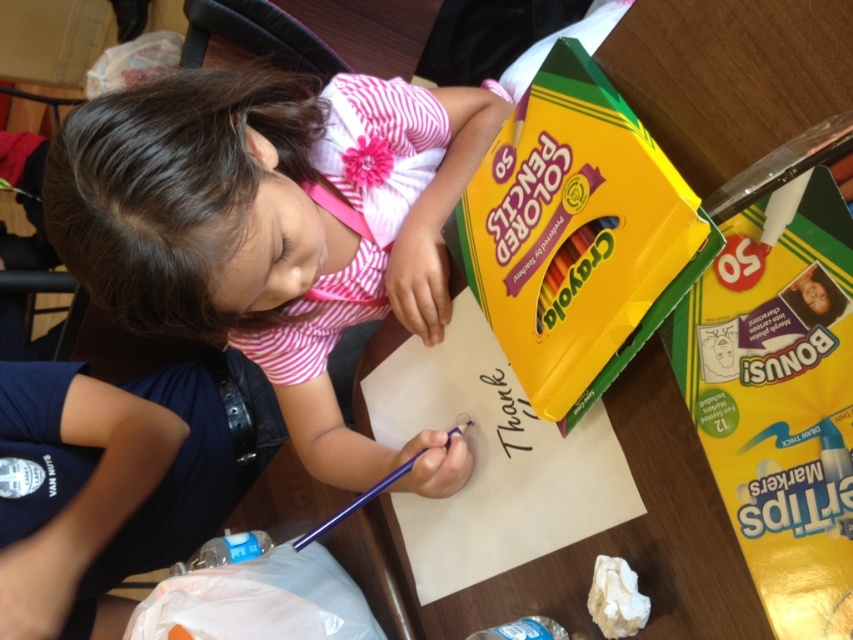
Looking at this image, you are an art teacher organizing supplies. You need to place the yellow glossy markers at right and the matte yellow crayola colored pencils at upper right into a storage bin. Which object should you place first to ensure both fit properly?

The matte yellow crayola colored pencils at upper right should be placed first because the yellow glossy markers at right is positioned under it, meaning the markers are lower and might be beneath the pencils, requiring the pencils to be placed first to make space.

Based on the photo, you are a child trying to reach the yellow glossy markers at right to draw with them. The smooth pink shirt at center is in the way. Can you move the shirt to get to the markers?

The smooth pink shirt at center is to the left of the yellow glossy markers at right, so you can move the shirt to the right to access the markers.

Consider the image. The young girl is wearing a smooth pink shirt at center and has yellow glossy markers at right on the table. Which object is taller?

The smooth pink shirt at center is taller than the yellow glossy markers at right.